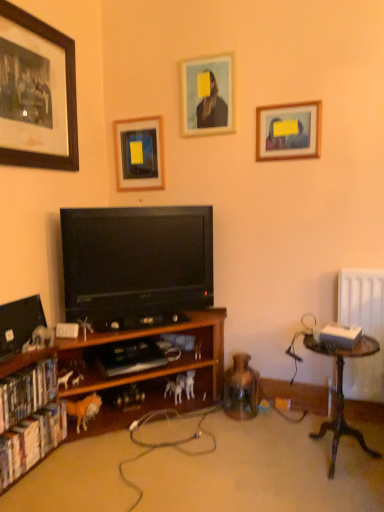
Find the location of a particular element. The image size is (384, 512). free space between hardcover book at lower left, which is the 1th book in bottom-to-top order, and wooden table at right is located at coordinates (190, 468).